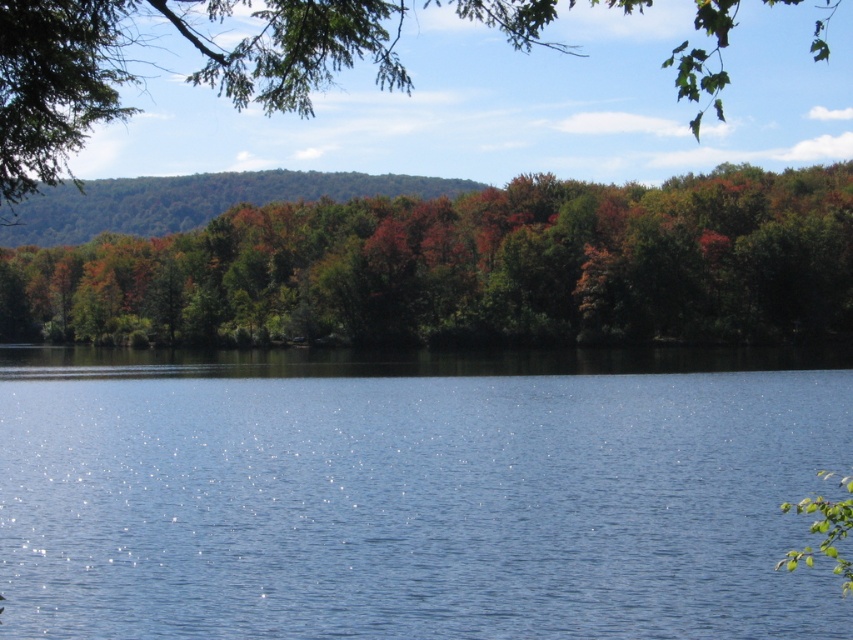
You are standing in the middle of the landscape scene. Looking around, you see the blue liquid water at center and the green leafy trees at center. Which object is positioned to the right side from your viewpoint?

The blue liquid water at center is to the right of the green leafy trees at center.

You are standing at the edge of the serene natural landscape and notice a point marked at coordinates (x=416, y=492). Which object from the scene does this point lie on?

The point at coordinates (x=416, y=492) lies on the blue liquid water at center, as stated in the objects description.

You are an environmental scientist analyzing the landscape. You observe the blue liquid water at center and the green leafy trees at center. Which object occupies a larger area in the scene?

The green leafy trees at center occupy a larger area in the scene compared to the blue liquid water at center.